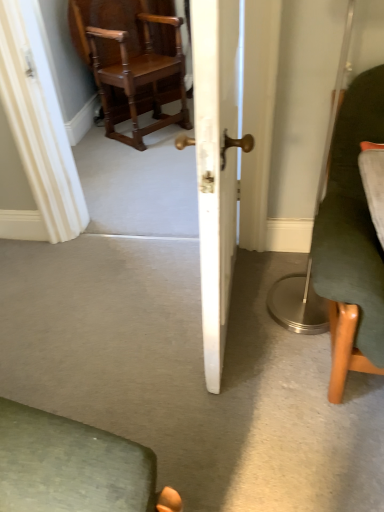
Question: From a real-world perspective, is polished wood chair at upper left, the 2th chair when ordered from right to left, under white wood door at center?

Choices:
 (A) no
 (B) yes

Answer: (B)

Question: Is polished wood chair at upper left, arranged as the 2th chair when ordered from the bottom, to the left of white wood door at center from the viewer's perspective?

Choices:
 (A) yes
 (B) no

Answer: (A)

Question: From the image's perspective, does polished wood chair at upper left, the 2th chair when ordered from right to left, appear lower than white wood door at center?

Choices:
 (A) no
 (B) yes

Answer: (A)

Question: Can you confirm if polished wood chair at upper left, the second chair when ordered from front to back, is shorter than white wood door at center?

Choices:
 (A) yes
 (B) no

Answer: (A)

Question: Is polished wood chair at upper left, the 2th chair when ordered from right to left, to the right of white wood door at center from the viewer's perspective?

Choices:
 (A) yes
 (B) no

Answer: (B)

Question: Can you confirm if polished wood chair at upper left, the second chair when ordered from front to back, is bigger than white wood door at center?

Choices:
 (A) no
 (B) yes

Answer: (B)

Question: Considering the relative sizes of white wood door at center and polished wood chair at upper left, positioned as the 1th chair in left-to-right order, in the image provided, is white wood door at center shorter than polished wood chair at upper left, positioned as the 1th chair in left-to-right order,?

Choices:
 (A) yes
 (B) no

Answer: (B)

Question: Is polished wood chair at upper left, arranged as the 2th chair when ordered from the bottom, located within white wood door at center?

Choices:
 (A) yes
 (B) no

Answer: (B)

Question: Is white wood door at center positioned behind polished wood chair at upper left, positioned as the 1th chair in left-to-right order?

Choices:
 (A) no
 (B) yes

Answer: (A)

Question: Is white wood door at center facing towards polished wood chair at upper left, positioned as the 1th chair in left-to-right order?

Choices:
 (A) no
 (B) yes

Answer: (A)

Question: Is polished wood chair at upper left, the second chair when ordered from front to back, at the back of white wood door at center?

Choices:
 (A) yes
 (B) no

Answer: (B)

Question: Is white wood door at center taller than polished wood chair at upper left, the second chair when ordered from front to back?

Choices:
 (A) yes
 (B) no

Answer: (A)

Question: Considering the relative positions of white wood door at center and dark green fabric chair at right, the 2th chair in the left-to-right sequence, in the image provided, is white wood door at center to the right of dark green fabric chair at right, the 2th chair in the left-to-right sequence, from the viewer's perspective?

Choices:
 (A) yes
 (B) no

Answer: (B)